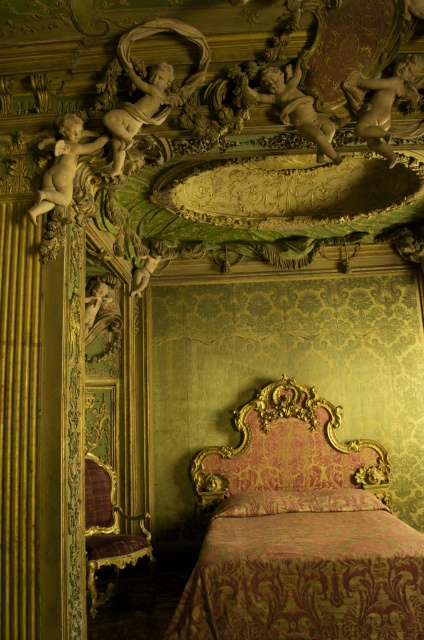
Between pink damask bed at center and matte gold cherub at upper left, which one has more height?

With more height is pink damask bed at center.

Who is shorter, pink damask bed at center or matte gold cherub at upper left?

matte gold cherub at upper left is shorter.

Locate an element on the screen. The width and height of the screenshot is (424, 640). pink damask bed at center is located at coordinates (300, 532).

Who is positioned more to the right, gold ornate headboard at center or white marble cherub at upper center?

From the viewer's perspective, gold ornate headboard at center appears more on the right side.

Is gold ornate headboard at center shorter than white marble cherub at upper center?

In fact, gold ornate headboard at center may be taller than white marble cherub at upper center.

Image resolution: width=424 pixels, height=640 pixels. What are the coordinates of `gold ornate headboard at center` in the screenshot? It's located at (290, 449).

Who is more forward, (410, 632) or (328, 426)?

Point (410, 632) is more forward.

Who is positioned more to the right, pink damask bed at center or gold ornate headboard at center?

pink damask bed at center

Locate an element on the screen. pink damask bed at center is located at coordinates (300, 532).